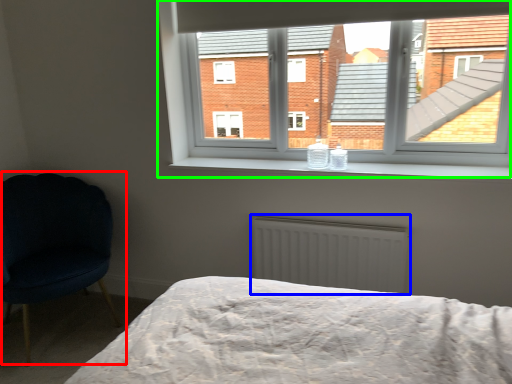
Question: Estimate the real-world distances between objects in this image. Which object is closer to chair (highlighted by a red box), radiator (highlighted by a blue box) or window (highlighted by a green box)?

Choices:
 (A) radiator
 (B) window

Answer: (B)